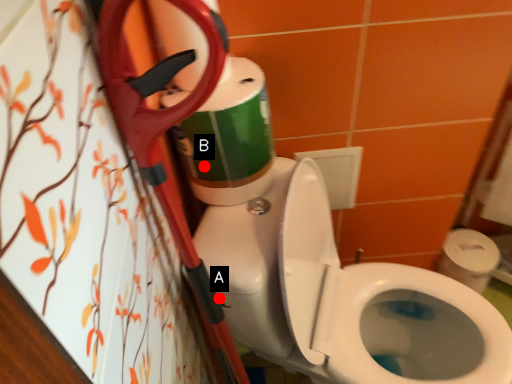
Question: Two points are circled on the image, labeled by A and B beside each circle. Which of the following is the closest to the observer?

Choices:
 (A) A is closer
 (B) B is closer

Answer: (A)